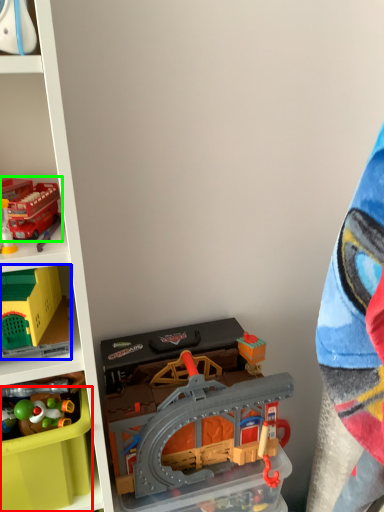
Question: Which object is the closest to the storage box (highlighted by a red box)? Choose among these: toy (highlighted by a blue box) or toy (highlighted by a green box).

Choices:
 (A) toy
 (B) toy

Answer: (A)